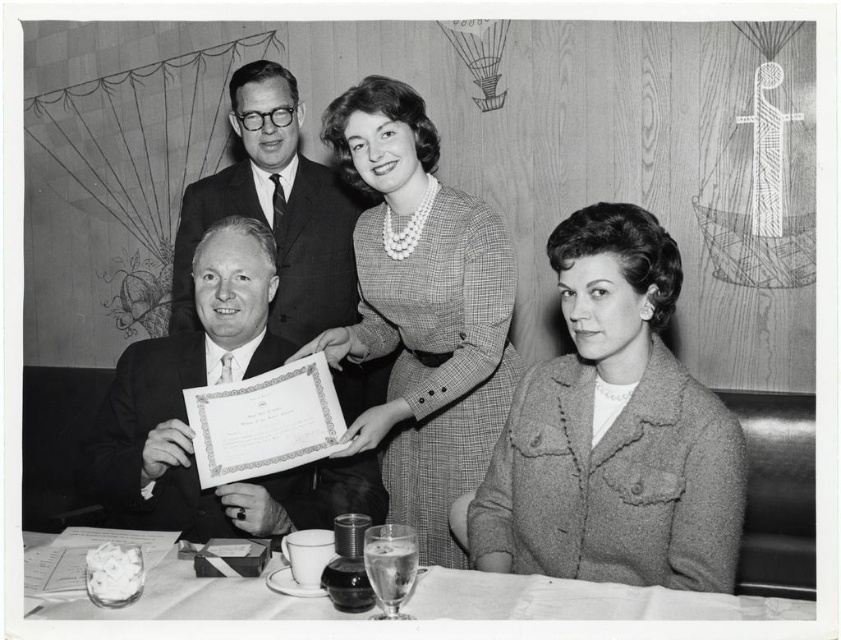
Image resolution: width=841 pixels, height=640 pixels. I want to click on checkered fabric dress at upper center, so click(x=421, y=310).

Between point (500, 385) and point (178, 616), which one is positioned behind?

Positioned behind is point (500, 385).

Identify the location of checkered fabric dress at upper center. (421, 310).

Based on the photo, does smooth black suit at upper left have a lesser width compared to checkered fabric dress at upper center?

Incorrect, smooth black suit at upper left's width is not less than checkered fabric dress at upper center's.

Is smooth black suit at upper left wider than checkered fabric dress at upper center?

Indeed, smooth black suit at upper left has a greater width compared to checkered fabric dress at upper center.

Describe the element at coordinates (527, 380) in the screenshot. This screenshot has width=841, height=640. I see `smooth black suit at upper left` at that location.

Identify the location of smooth black suit at upper left. (527, 380).

Which of these two, smooth black suit at lower left or smooth glass table at lower center, stands shorter?

smooth glass table at lower center is shorter.

Who is higher up, smooth black suit at lower left or smooth glass table at lower center?

Positioned higher is smooth black suit at lower left.

Image resolution: width=841 pixels, height=640 pixels. Find the location of `smooth black suit at lower left`. smooth black suit at lower left is located at coordinates (188, 420).